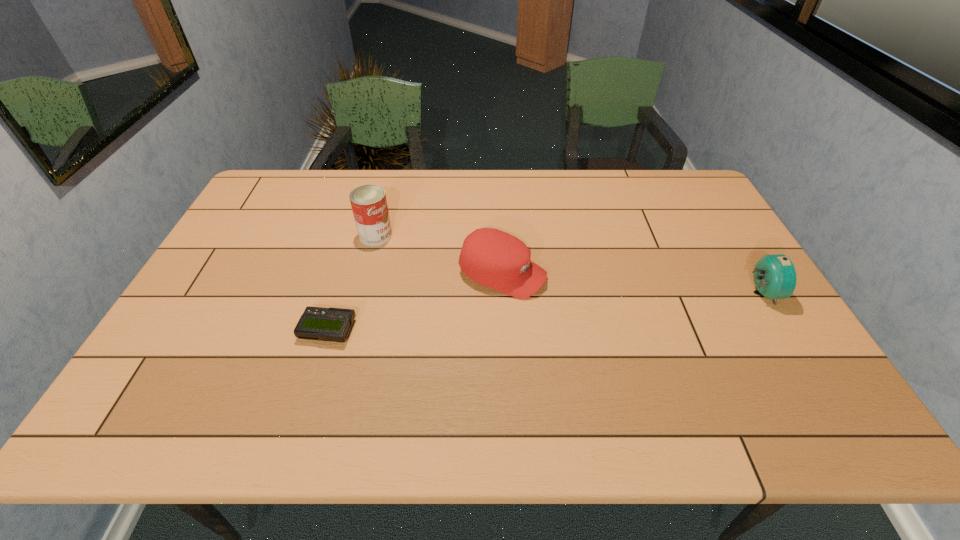
At what (x,y) coordinates should I click in order to perform the action: click on blank space located on the front-facing side of the third object from left to right. Please return your answer as a coordinate pair (x, y). The image size is (960, 540). Looking at the image, I should click on (575, 295).

The image size is (960, 540). Identify the location of vacant space located 0.200m on the front-facing side of the third object from left to right. (615, 308).

Identify the location of vacant space located on the front-facing side of the third object from left to right. (674, 327).

Locate an element on the screen. The height and width of the screenshot is (540, 960). object located at the right edge is located at coordinates (774, 276).

Image resolution: width=960 pixels, height=540 pixels. I want to click on vacant space at the far edge of the desktop, so click(x=606, y=177).

Image resolution: width=960 pixels, height=540 pixels. I want to click on vacant space at the near edge of the desktop, so click(x=346, y=370).

Where is `vacant space at the left edge`? The width and height of the screenshot is (960, 540). vacant space at the left edge is located at coordinates 260,253.

This screenshot has width=960, height=540. Identify the location of vacant space at the right edge of the desktop. (677, 217).

Locate an element on the screen. vacant space at the near right corner of the desktop is located at coordinates (757, 357).

What are the coordinates of `free space between the nearest object and the can` in the screenshot? It's located at (351, 283).